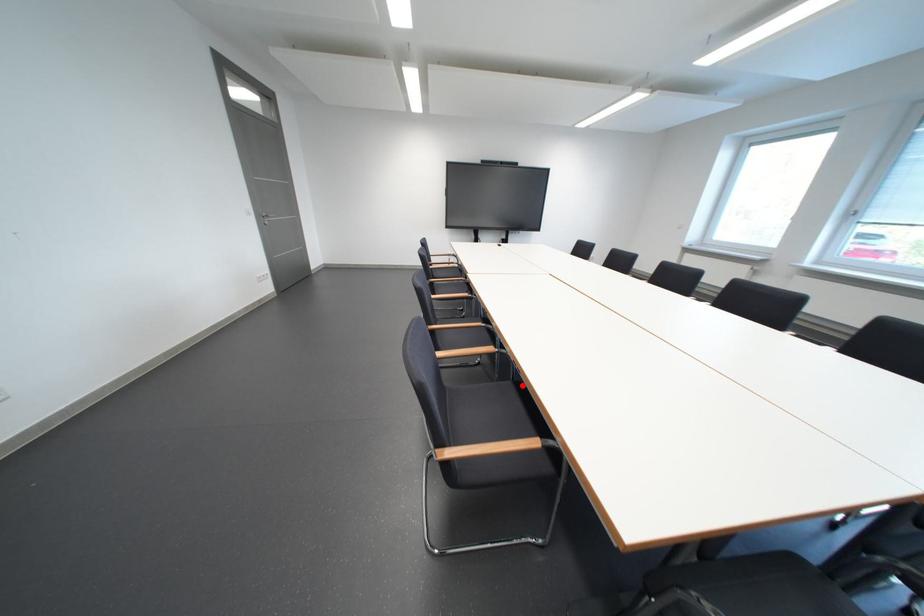
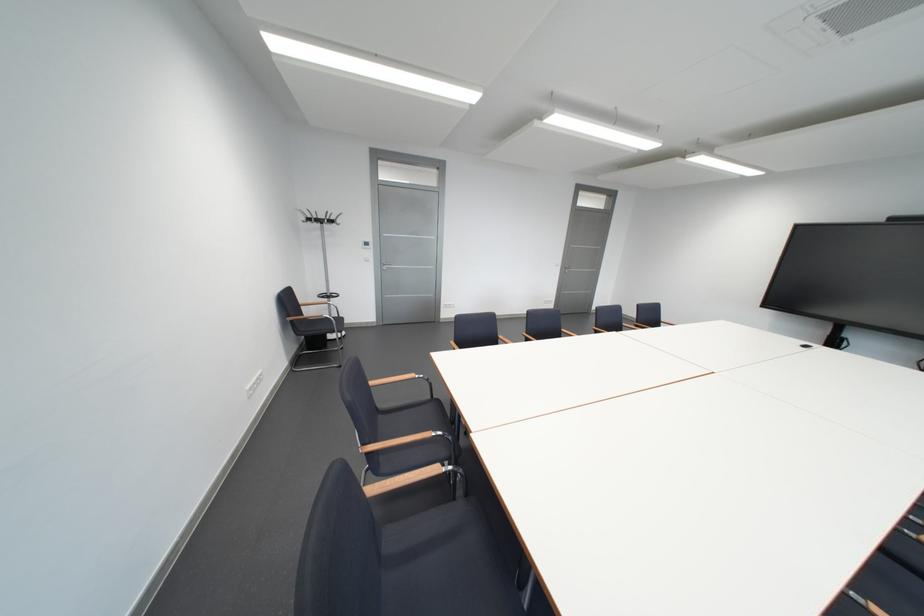
Question: I am providing you with two images of the same scene from different viewpoints. A red point is marked on the first image. At the location where the point appears in image 1, is it still visible in image 2?

Choices:
 (A) Yes
 (B) No

Answer: (B)